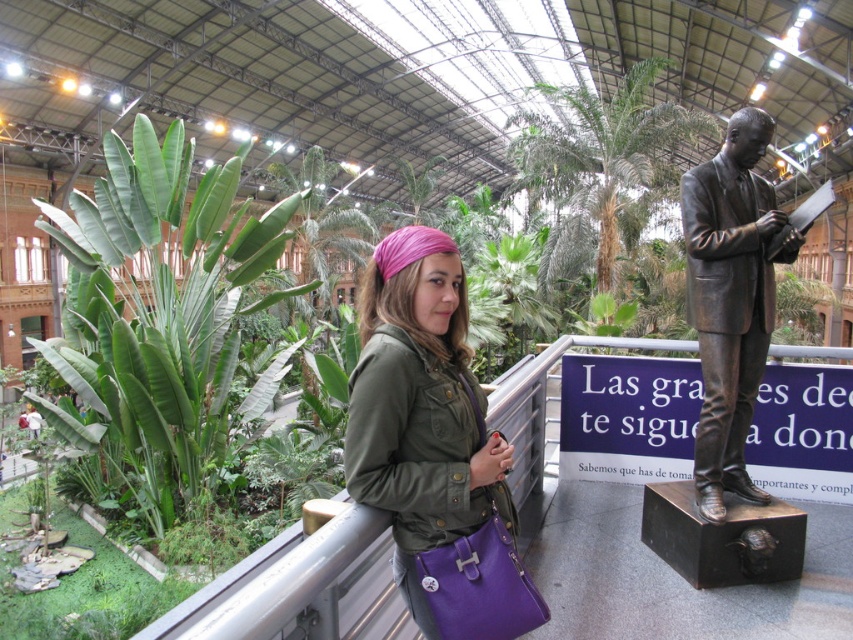
Question: Among these objects, which one is nearest to the camera?

Choices:
 (A) green leafy plant at left
 (B) matte green jacket at center
 (C) bronze statue at right

Answer: (B)

Question: Considering the real-world distances, which object is closest to the bronze statue at right?

Choices:
 (A) matte green jacket at center
 (B) green leafy plant at lower left
 (C) green leafy plant at center
 (D) green leafy plant at left

Answer: (A)

Question: Which point is farther to the camera?

Choices:
 (A) green leafy plant at lower left
 (B) green leafy plant at left
 (C) matte green jacket at center
 (D) bronze statue at right

Answer: (B)

Question: Can you confirm if bronze statue at right is positioned below green leafy plant at lower left?

Choices:
 (A) yes
 (B) no

Answer: (B)

Question: Where is green leafy plant at left located in relation to bronze statue at right in the image?

Choices:
 (A) above
 (B) below

Answer: (A)

Question: Is green leafy plant at left to the right of green leafy plant at center from the viewer's perspective?

Choices:
 (A) no
 (B) yes

Answer: (A)